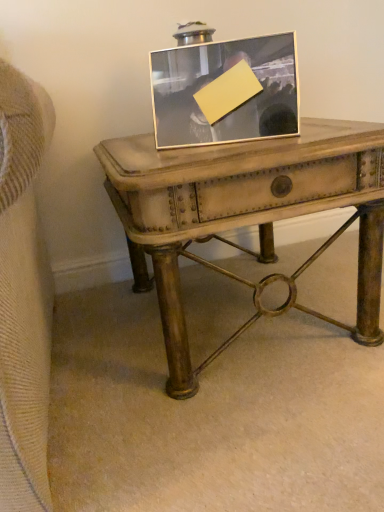
The height and width of the screenshot is (512, 384). Describe the element at coordinates (221, 79) in the screenshot. I see `silver/metallic picture frame at center` at that location.

Locate an element on the screen. The height and width of the screenshot is (512, 384). silver/metallic picture frame at center is located at coordinates (221, 79).

This screenshot has width=384, height=512. In order to click on distressed wood table at center in this screenshot , I will do point(247,213).

This screenshot has width=384, height=512. Describe the element at coordinates (247, 213) in the screenshot. I see `distressed wood table at center` at that location.

You are a GUI agent. You are given a task and a screenshot of the screen. Output one action in this format:
    pyautogui.click(x=<x>, y=<y>)
    Task: Click on the silver/metallic picture frame at center
    
    Given the screenshot: What is the action you would take?
    pyautogui.click(x=221, y=79)

Can you confirm if silver/metallic picture frame at center is positioned to the right of distressed wood table at center?

Incorrect, silver/metallic picture frame at center is not on the right side of distressed wood table at center.

Considering the relative positions of silver/metallic picture frame at center and distressed wood table at center in the image provided, is silver/metallic picture frame at center in front of distressed wood table at center?

No, it is not.

Which is in front, point (187, 51) or point (244, 153)?

The point (244, 153) is more forward.

From the image's perspective, who appears lower, silver/metallic picture frame at center or distressed wood table at center?

distressed wood table at center, from the image's perspective.

From a real-world perspective, is silver/metallic picture frame at center positioned above or below distressed wood table at center?

silver/metallic picture frame at center is situated higher than distressed wood table at center in the real world.

Considering the relative sizes of silver/metallic picture frame at center and distressed wood table at center in the image provided, is silver/metallic picture frame at center wider than distressed wood table at center?

Incorrect, the width of silver/metallic picture frame at center does not surpass that of distressed wood table at center.

Looking at this image, is silver/metallic picture frame at center shorter than distressed wood table at center?

Correct, silver/metallic picture frame at center is not as tall as distressed wood table at center.

Is silver/metallic picture frame at center smaller than distressed wood table at center?

Yes, silver/metallic picture frame at center is smaller than distressed wood table at center.

Is silver/metallic picture frame at center situated inside distressed wood table at center or outside?

silver/metallic picture frame at center is located beyond the bounds of distressed wood table at center.

Is silver/metallic picture frame at center positioned far away from distressed wood table at center?

silver/metallic picture frame at center is actually quite close to distressed wood table at center.

Is distressed wood table at center at the back of silver/metallic picture frame at center?

No.

What's the angular difference between silver/metallic picture frame at center and distressed wood table at center's facing directions?

There is a 25.8-degree angle between the facing directions of silver/metallic picture frame at center and distressed wood table at center.

You are a GUI agent. You are given a task and a screenshot of the screen. Output one action in this format:
    pyautogui.click(x=<x>, y=<y>)
    Task: Click on the picture frame located above the distressed wood table at center (from a real-world perspective)
    The width and height of the screenshot is (384, 512).
    Given the screenshot: What is the action you would take?
    pyautogui.click(x=221, y=79)

Does distressed wood table at center appear on the left side of silver/metallic picture frame at center?

No.

Which object is closer to the camera taking this photo, distressed wood table at center or silver/metallic picture frame at center?

distressed wood table at center.

Which is in front, point (275, 172) or point (211, 123)?

The point (275, 172) is closer to the camera.

Looking at this image, from the image's perspective, is distressed wood table at center on silver/metallic picture frame at center?

No, from the image's perspective, distressed wood table at center is not above silver/metallic picture frame at center.

From a real-world perspective, is distressed wood table at center located higher than silver/metallic picture frame at center?

Incorrect, from a real-world perspective, distressed wood table at center is lower than silver/metallic picture frame at center.

Which of these two, distressed wood table at center or silver/metallic picture frame at center, is thinner?

Thinner between the two is silver/metallic picture frame at center.

Is distressed wood table at center taller or shorter than silver/metallic picture frame at center?

distressed wood table at center is taller than silver/metallic picture frame at center.

Who is bigger, distressed wood table at center or silver/metallic picture frame at center?

distressed wood table at center is bigger.

Is distressed wood table at center positioned beyond the bounds of silver/metallic picture frame at center?

Yes, distressed wood table at center is not within silver/metallic picture frame at center.

Is distressed wood table at center beside silver/metallic picture frame at center?

No, distressed wood table at center is not making contact with silver/metallic picture frame at center.

Could you tell me if distressed wood table at center is facing silver/metallic picture frame at center?

No.

How different are the orientations of distressed wood table at center and silver/metallic picture frame at center in degrees?

They differ by 25.8 degrees in their facing directions.

Measure the distance from distressed wood table at center to silver/metallic picture frame at center.

distressed wood table at center and silver/metallic picture frame at center are 7.05 inches apart.

You are a GUI agent. You are given a task and a screenshot of the screen. Output one action in this format:
    pyautogui.click(x=<x>, y=<y>)
    Task: Click on the table on the right of silver/metallic picture frame at center
    This screenshot has height=512, width=384.
    Given the screenshot: What is the action you would take?
    pyautogui.click(x=247, y=213)

Locate an element on the screen. The width and height of the screenshot is (384, 512). picture frame above the distressed wood table at center (from the image's perspective) is located at coordinates (221, 79).

The image size is (384, 512). In order to click on picture frame that appears above the distressed wood table at center (from a real-world perspective) in this screenshot , I will do point(221,79).